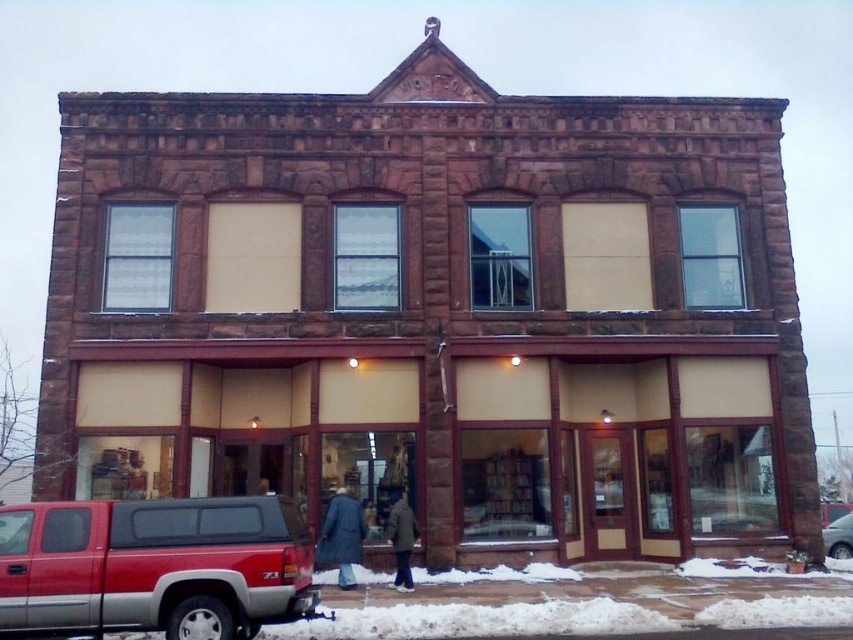
Who is lower down, dark blue coat at center or dark brown leather coat at center?

dark brown leather coat at center

From the picture: Does dark blue coat at center have a greater width compared to dark brown leather coat at center?

Correct, the width of dark blue coat at center exceeds that of dark brown leather coat at center.

Between point (340, 488) and point (403, 589), which one is positioned in front?

Point (403, 589) is more forward.

Identify the location of dark blue coat at center. (341, 536).

Is red metallic pickup truck at lower left bigger than dark brown leather coat at center?

Correct, red metallic pickup truck at lower left is larger in size than dark brown leather coat at center.

How much distance is there between red metallic pickup truck at lower left and dark brown leather coat at center?

A distance of 4.88 meters exists between red metallic pickup truck at lower left and dark brown leather coat at center.

Is point (55, 520) positioned behind point (399, 589)?

No, it is not.

Where is `red metallic pickup truck at lower left`? red metallic pickup truck at lower left is located at coordinates (154, 566).

Image resolution: width=853 pixels, height=640 pixels. Find the location of `dark brown leather coat at center`. dark brown leather coat at center is located at coordinates (401, 540).

Is dark brown leather coat at center positioned at the back of metallic silver car at lower right?

No, it is in front of metallic silver car at lower right.

Is point (399, 528) behind point (846, 541)?

That is False.

You are a GUI agent. You are given a task and a screenshot of the screen. Output one action in this format:
    pyautogui.click(x=<x>, y=<y>)
    Task: Click on the dark brown leather coat at center
    Image resolution: width=853 pixels, height=640 pixels.
    Given the screenshot: What is the action you would take?
    pyautogui.click(x=401, y=540)